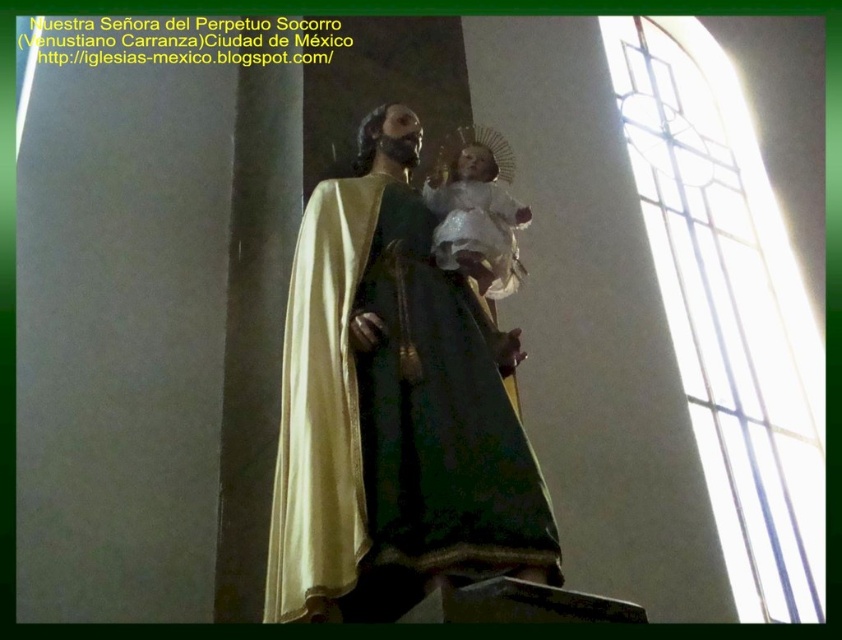
You are a visitor standing in front of the statue inside the church. You want to take a photo of both the gold polished statue at center and the white porcelain baby at center. Since you have a wide angle lens, will you be able to capture both in one shot without moving your camera?

The gold polished statue at center is located below the white porcelain baby at center, so since they are positioned vertically, you can capture both in one shot as long as your camera is positioned to include the entire vertical space between them.